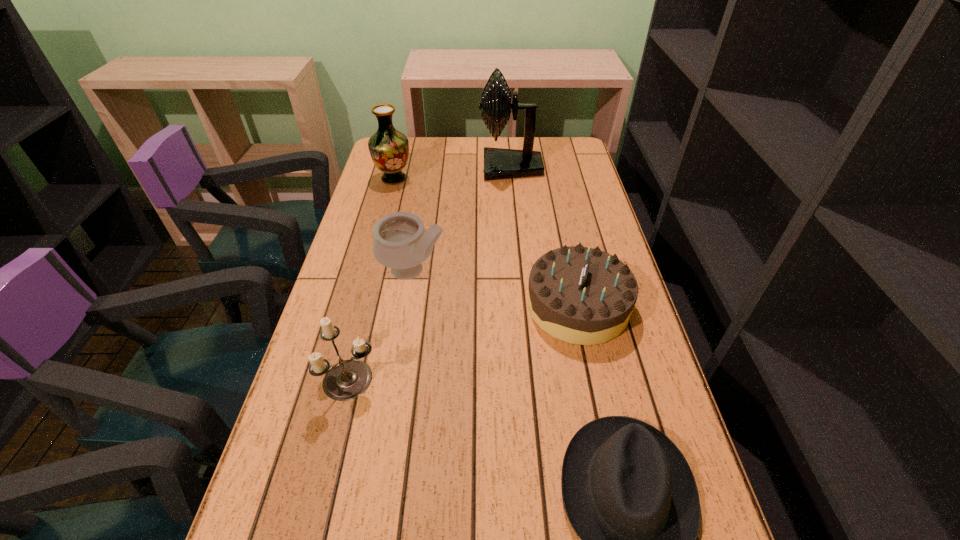
Find the location of a particular element. the tallest object is located at coordinates 499,163.

The width and height of the screenshot is (960, 540). I want to click on the fifth shortest object, so click(389, 148).

Find the location of a particular element. The width and height of the screenshot is (960, 540). pottery is located at coordinates (400, 242).

Find the location of a particular element. The image size is (960, 540). candle holder is located at coordinates (348, 379).

At what (x,y) coordinates should I click in order to perform the action: click on the second shortest object. Please return your answer as a coordinate pair (x, y). The image size is (960, 540). Looking at the image, I should click on (580, 295).

Where is `blank area located in front of the fan to blow air`? blank area located in front of the fan to blow air is located at coordinates (424, 168).

Locate an element on the screen. The height and width of the screenshot is (540, 960). free location located 0.230m in front of the fan to blow air is located at coordinates (417, 168).

This screenshot has height=540, width=960. What are the coordinates of `vacant area situated in front of the fan to blow air` in the screenshot? It's located at (466, 168).

Locate an element on the screen. The height and width of the screenshot is (540, 960). vacant space located on the back of the second tallest object is located at coordinates (403, 142).

Locate an element on the screen. vacant point located on the right of the pottery is located at coordinates (577, 271).